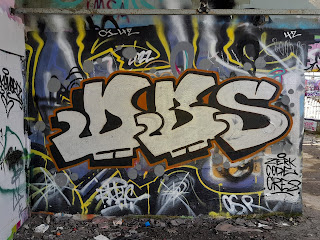
The height and width of the screenshot is (240, 320). In order to click on 3 walls in this screenshot , I will do `click(16, 201)`, `click(262, 161)`, `click(316, 90)`.